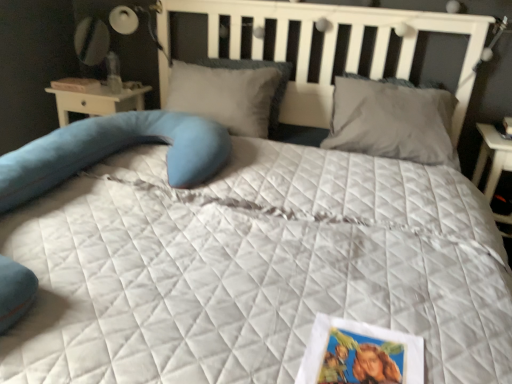
At what (x,y) coordinates should I click in order to perform the action: click on free location above white paper book at upper left (from a real-world perspective). Please return your answer as a coordinate pair (x, y). Looking at the image, I should click on (77, 80).